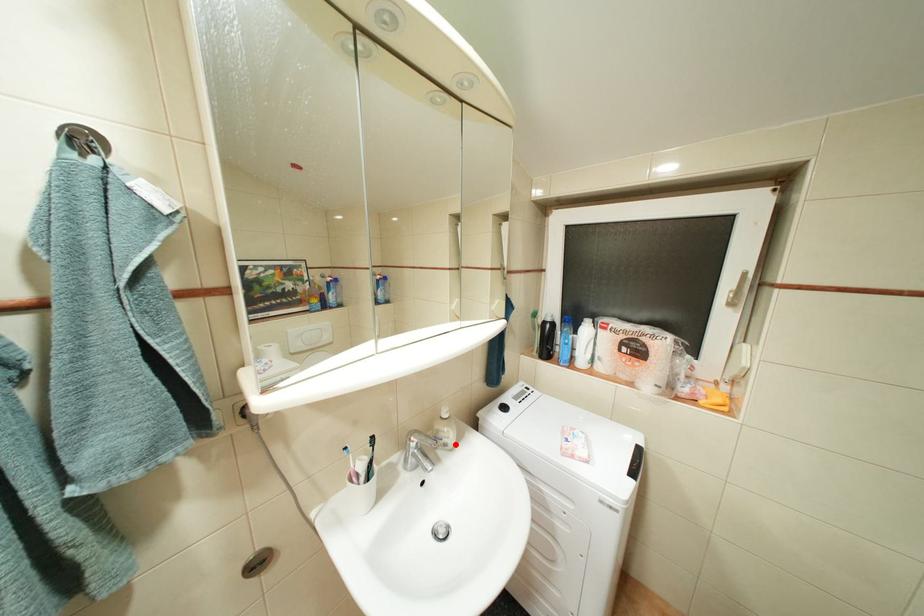
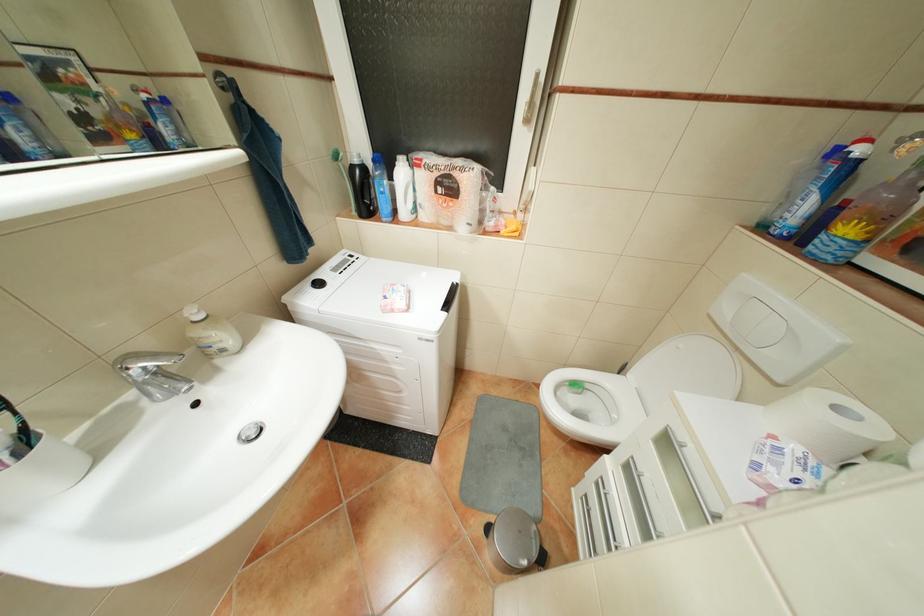
Question: A red point is marked in image1. In image2, is the corresponding 3D point closer to the camera or farther? Reply with the corresponding letter.

Choices:
 (A) The corresponding 3D point is closer.
 (B) The corresponding 3D point is farther.

Answer: (A)